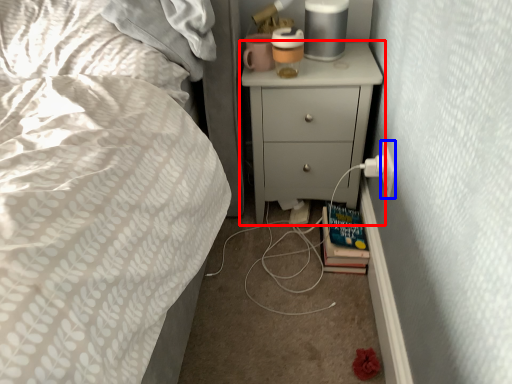
Question: Which object is further to the camera taking this photo, chest of drawers (highlighted by a red box) or electric outlet (highlighted by a blue box)?

Choices:
 (A) chest of drawers
 (B) electric outlet

Answer: (A)